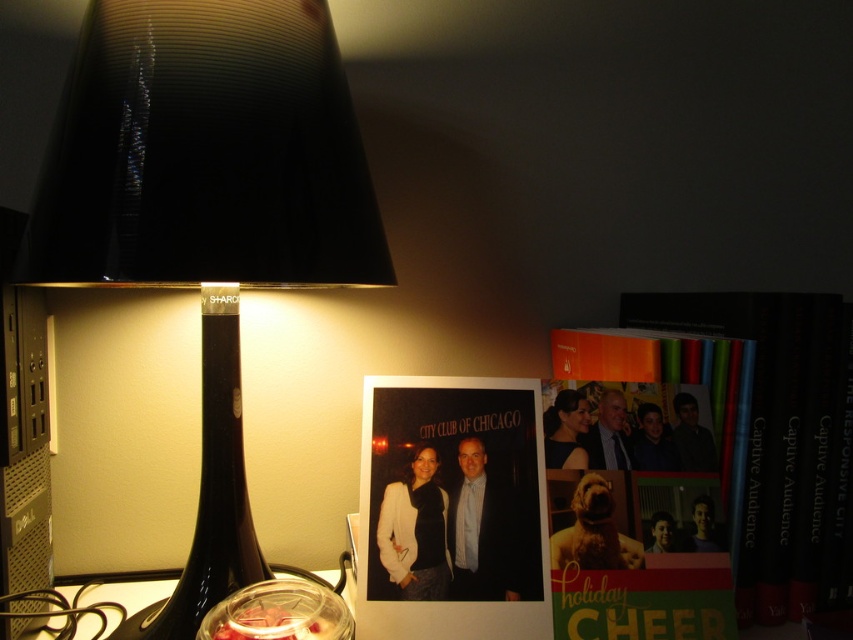
You are an interior designer arranging furniture. You want to place a new sofa in this room such that it faces away from the black glass lamp at left and towards the matte paper photo at center. Based on their positions, which direction should the sofa face?

The sofa should face towards the matte paper photo at center because the black glass lamp at left is positioned over it, meaning the photo is located below the lamp. Facing the photo would mean the sofa is oriented towards the center area where the photo is placed, away from the lamp on the left.

You are an interior designer assessing the lighting in this room. You need to determine if the black glass lamp at left can provide sufficient light to the matte paper photo at center. Based on their heights, can the lamp illuminate the photo adequately?

The black glass lamp at left is taller than the matte paper photo at center. Since the lamp is taller, it can cast light downward over the photo, potentially illuminating it sufficiently.